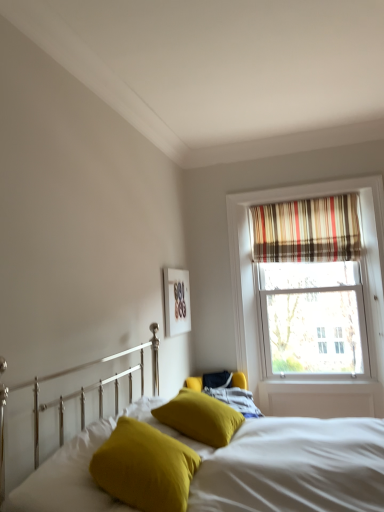
Locate an element on the screen. The height and width of the screenshot is (512, 384). free location above striped fabric curtain at upper right (from a real-world perspective) is located at coordinates (302, 197).